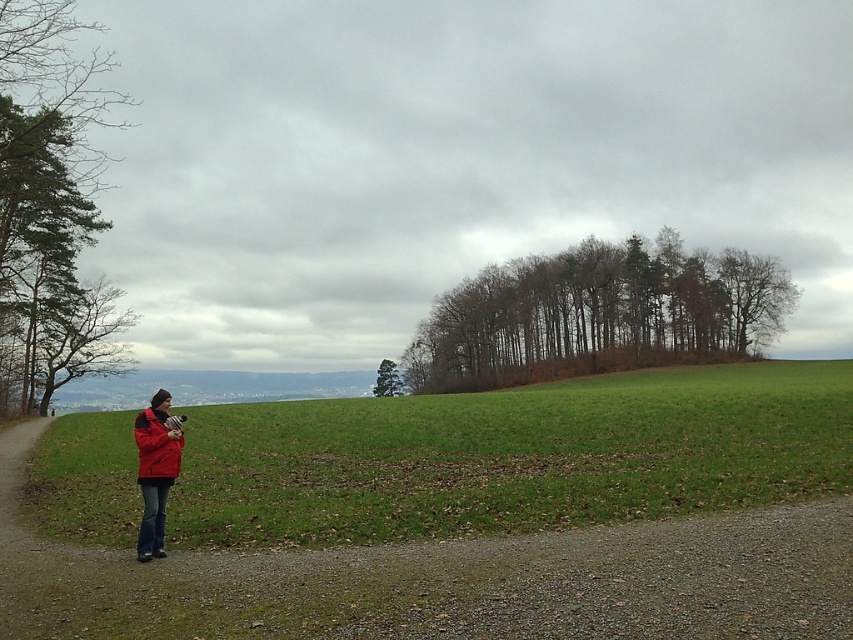
Question: Which of the following is the farthest from the observer?

Choices:
 (A) green matte tree at center
 (B) matte red jacket at lower left
 (C) matte red jacket at left

Answer: (A)

Question: Does gravel path at lower left have a lesser width compared to matte red jacket at left?

Choices:
 (A) no
 (B) yes

Answer: (A)

Question: Which object is positioned farthest from the green matte tree at center?

Choices:
 (A) brown leafy trees at center
 (B) gravel path at lower left
 (C) matte red jacket at left
 (D) green leafy tree at left

Answer: (B)

Question: Which object appears farthest from the camera in this image?

Choices:
 (A) green leafy tree at left
 (B) green matte tree at center

Answer: (B)

Question: Can you confirm if matte red jacket at left is positioned to the right of green matte tree at center?

Choices:
 (A) no
 (B) yes

Answer: (B)

Question: Can you confirm if green leafy tree at left is smaller than green matte tree at center?

Choices:
 (A) no
 (B) yes

Answer: (A)